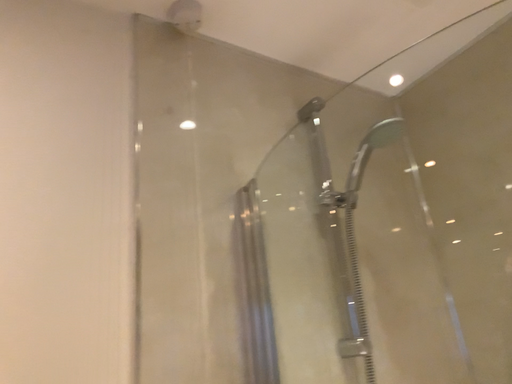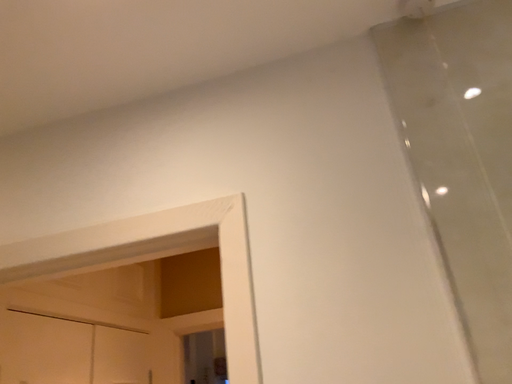
Question: Which way did the camera rotate in the video?

Choices:
 (A) rotated downward
 (B) rotated upward

Answer: (A)